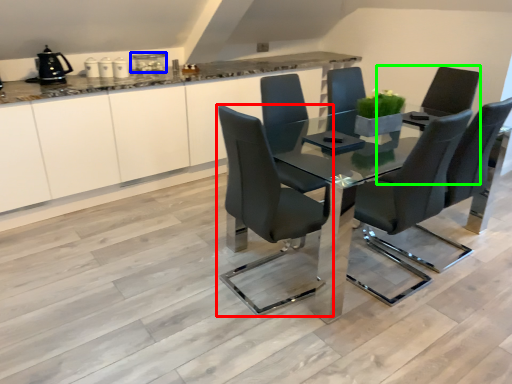
Question: Which object is positioned closest to chair (highlighted by a red box)? Select from appliance (highlighted by a blue box) and armchair (highlighted by a green box).

Choices:
 (A) appliance
 (B) armchair

Answer: (B)